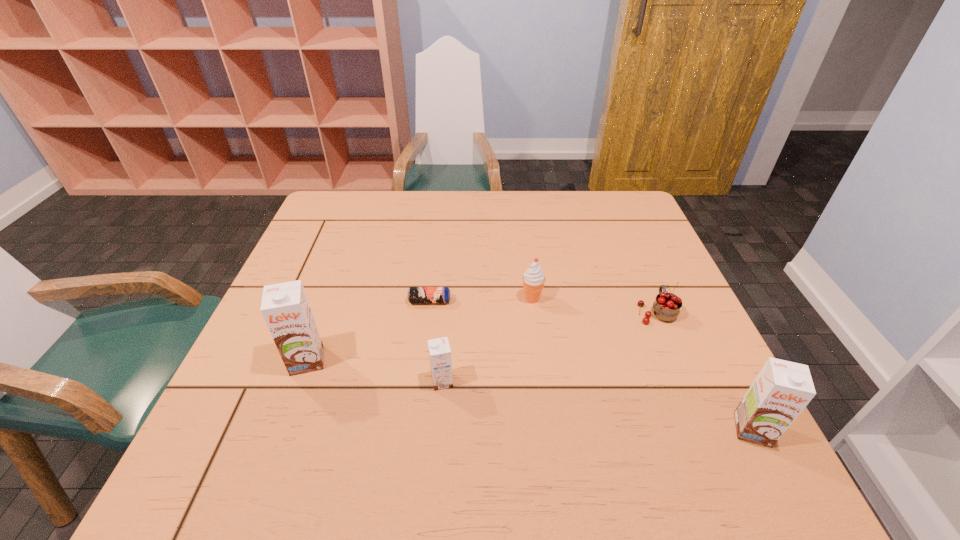
The height and width of the screenshot is (540, 960). In order to click on free space between the shortest object and the fifth object from left to right in this screenshot , I will do click(543, 306).

The width and height of the screenshot is (960, 540). Identify the location of free space between the shortest object and the leftmost chocolate milk. (369, 330).

Locate an element on the screen. Image resolution: width=960 pixels, height=540 pixels. vacant space in between the leftmost chocolate milk and the cherry is located at coordinates (482, 336).

Locate an element on the screen. This screenshot has height=540, width=960. the fourth closest object to the leftmost chocolate milk is located at coordinates (667, 306).

Locate which object ranks in proximity to the nearest chocolate milk. Please provide its 2D coordinates. Your answer should be formatted as a tuple, i.e. [(x, y)], where the tuple contains the x and y coordinates of a point satisfying the conditions above.

[(667, 306)]

Find the location of a particular element. The width and height of the screenshot is (960, 540). chocolate milk that is the second closest to the fourth object from left to right is located at coordinates (782, 389).

Select which chocolate milk is the second closest to the second chocolate milk from right to left. Please provide its 2D coordinates. Your answer should be formatted as a tuple, i.e. [(x, y)], where the tuple contains the x and y coordinates of a point satisfying the conditions above.

[(782, 389)]

Locate an element on the screen. vacant space that satisfies the following two spatial constraints: 1. on the front side of the second chocolate milk from right to left; 2. on the left side of the beer can is located at coordinates (420, 381).

Where is `vacant space that satisfies the following two spatial constraints: 1. on the front side of the second tallest chocolate milk; 2. on the right side of the icecream`? vacant space that satisfies the following two spatial constraints: 1. on the front side of the second tallest chocolate milk; 2. on the right side of the icecream is located at coordinates (549, 429).

In order to click on vacant space that satisfies the following two spatial constraints: 1. on the front side of the leftmost object; 2. on the left side of the second chocolate milk from left to right in this screenshot , I will do `click(300, 381)`.